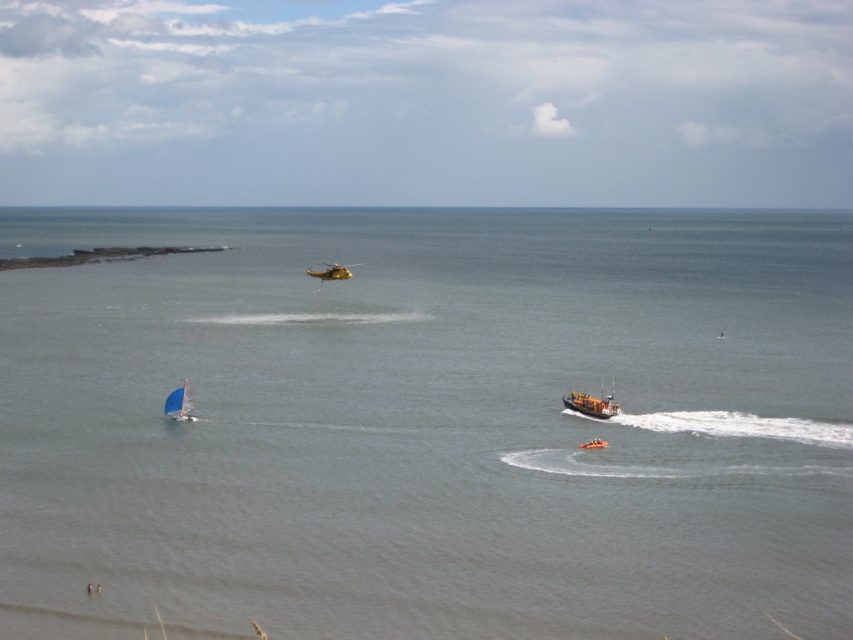
Between yellow matte helicopter at upper center and yellow rubber dinghy at center, which one has more height?

With more height is yellow matte helicopter at upper center.

Is point (329, 275) behind point (585, 449)?

Yes, point (329, 275) is farther from viewer.

Where is `yellow matte helicopter at upper center`? yellow matte helicopter at upper center is located at coordinates (331, 273).

This screenshot has height=640, width=853. I want to click on yellow matte helicopter at upper center, so click(x=331, y=273).

Between brown coral reef at upper left and yellow rubber dinghy at center, which one is positioned higher?

Positioned higher is brown coral reef at upper left.

Who is more distant from viewer, (135, 256) or (604, 442)?

The point (135, 256) is more distant.

Where is `brown coral reef at upper left`? This screenshot has width=853, height=640. brown coral reef at upper left is located at coordinates (100, 256).

Where is `gray water at center`? This screenshot has width=853, height=640. gray water at center is located at coordinates (428, 424).

Is gray water at center wider than yellow matte helicopter at upper center?

Yes, gray water at center is wider than yellow matte helicopter at upper center.

Find the location of a particular element. The width and height of the screenshot is (853, 640). gray water at center is located at coordinates tap(428, 424).

This screenshot has width=853, height=640. What are the coordinates of `gray water at center` in the screenshot? It's located at (428, 424).